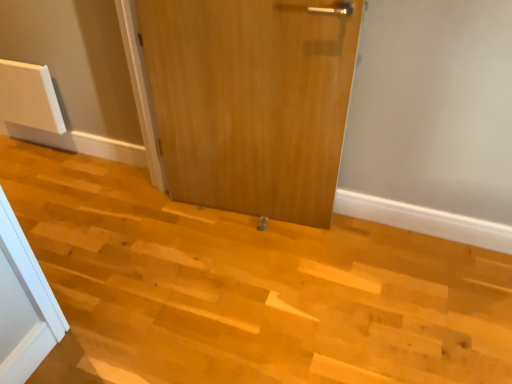
The image size is (512, 384). I want to click on wooden door at center, so click(251, 100).

This screenshot has height=384, width=512. What do you see at coordinates (251, 100) in the screenshot? I see `wooden door at center` at bounding box center [251, 100].

What are the coordinates of `wooden door at center` in the screenshot? It's located at (251, 100).